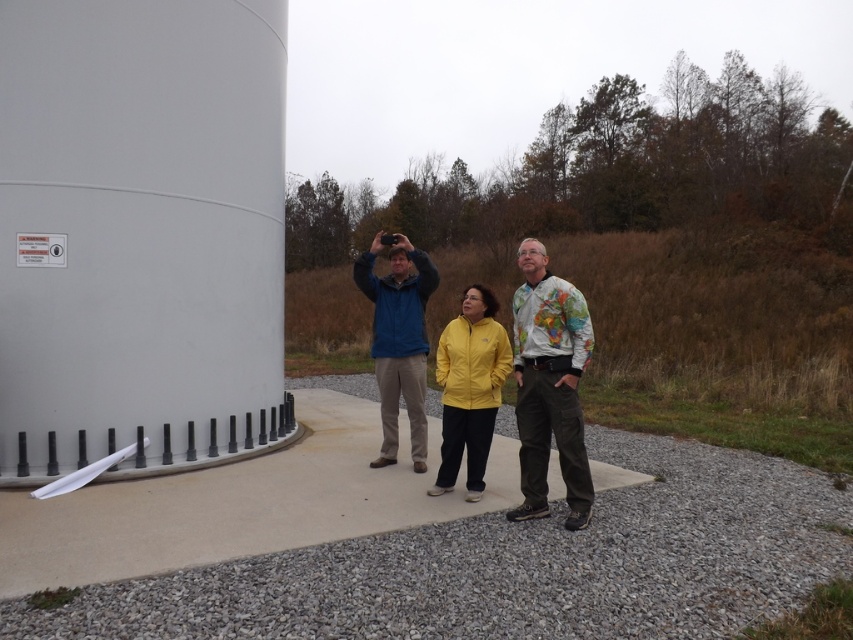
Does point (1, 44) come farther from viewer compared to point (566, 465)?

That is True.

Is white matte water tower at left above yellow fabric jacket at center?

Yes, white matte water tower at left is above yellow fabric jacket at center.

Is point (39, 204) less distant than point (554, 397)?

That is False.

In order to click on white matte water tower at left in this screenshot , I will do `click(140, 234)`.

Which is below, white matte water tower at left or map-patterned shirt at center?

Positioned lower is map-patterned shirt at center.

Does white matte water tower at left appear on the right side of map-patterned shirt at center?

No, white matte water tower at left is not to the right of map-patterned shirt at center.

Locate an element on the screen. white matte water tower at left is located at coordinates pos(140,234).

Does yellow fabric jacket at center come in front of yellow matte jacket at center?

Answer: Yes, it is.

Between yellow fabric jacket at center and yellow matte jacket at center, which one is positioned lower?

Positioned lower is yellow matte jacket at center.

Describe the element at coordinates (549, 385) in the screenshot. I see `yellow fabric jacket at center` at that location.

Where is `yellow fabric jacket at center`? The height and width of the screenshot is (640, 853). yellow fabric jacket at center is located at coordinates (549, 385).